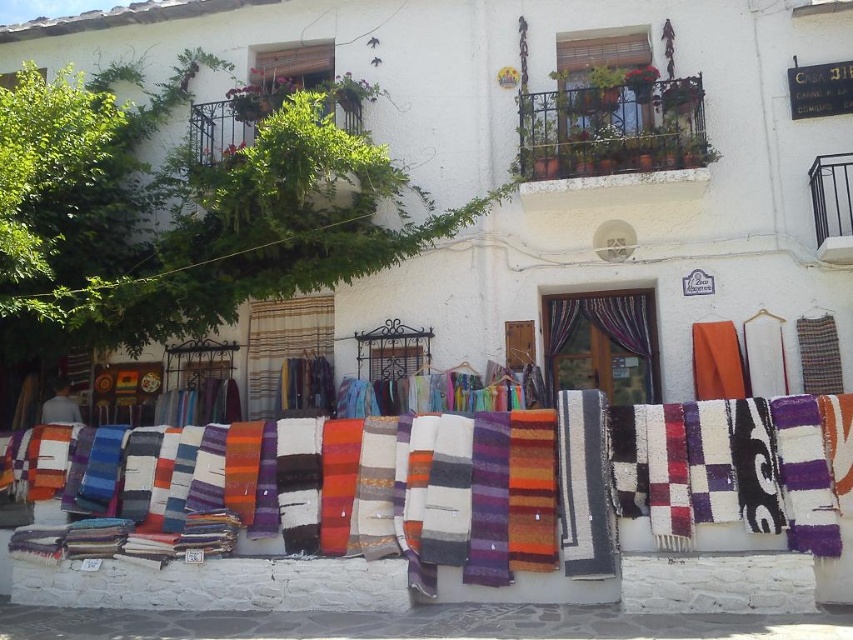
Is point (598, 320) in front of point (300, 320)?

Yes, it is in front of point (300, 320).

Does multicolored woven curtain at center appear under striped fabric at center?

Incorrect, multicolored woven curtain at center is not positioned below striped fabric at center.

Is point (566, 305) closer to viewer compared to point (277, 362)?

Yes.

Locate an element on the screen. The height and width of the screenshot is (640, 853). multicolored woven curtain at center is located at coordinates (602, 342).